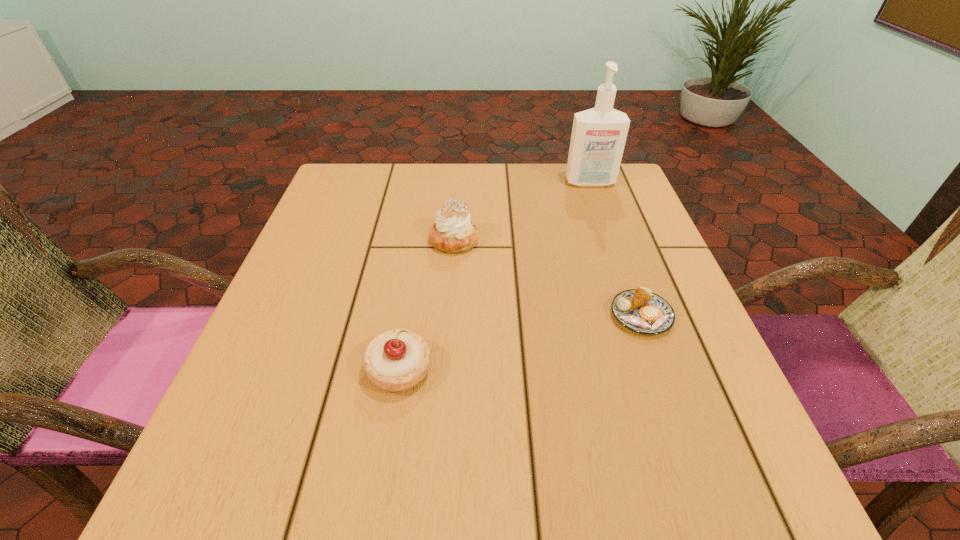
In the image, there is a desktop. Find the location of `free space at the far left corner`. free space at the far left corner is located at coordinates (384, 166).

You are a GUI agent. You are given a task and a screenshot of the screen. Output one action in this format:
    pyautogui.click(x=<x>, y=<y>)
    Task: Click on the blank area at the near left corner
    The image size is (960, 540).
    Given the screenshot: What is the action you would take?
    pyautogui.click(x=266, y=479)

Identify the location of vacant space at the far right corner of the desktop. Image resolution: width=960 pixels, height=540 pixels. (636, 196).

Where is `vacant space at the near right corner of the desktop`? This screenshot has height=540, width=960. vacant space at the near right corner of the desktop is located at coordinates (763, 482).

You are a GUI agent. You are given a task and a screenshot of the screen. Output one action in this format:
    pyautogui.click(x=<x>, y=<y>)
    Task: Click on the free point between the third shortest object and the shortest pastry
    The width and height of the screenshot is (960, 540).
    Given the screenshot: What is the action you would take?
    pyautogui.click(x=547, y=278)

Identify the location of free space between the nearest pastry and the shortest object. The image size is (960, 540). (520, 343).

You are a GUI agent. You are given a task and a screenshot of the screen. Output one action in this format:
    pyautogui.click(x=<x>, y=<y>)
    Task: Click on the free space between the third tallest object and the farthest pastry
    The width and height of the screenshot is (960, 540).
    Given the screenshot: What is the action you would take?
    pyautogui.click(x=427, y=305)

Where is `empty location between the tallest pastry and the shortest object`? empty location between the tallest pastry and the shortest object is located at coordinates (547, 278).

Identify the location of free space between the tallest pastry and the rightmost pastry. (547, 278).

Identify the location of unoccupied position between the second shortest object and the shortest object. (520, 343).